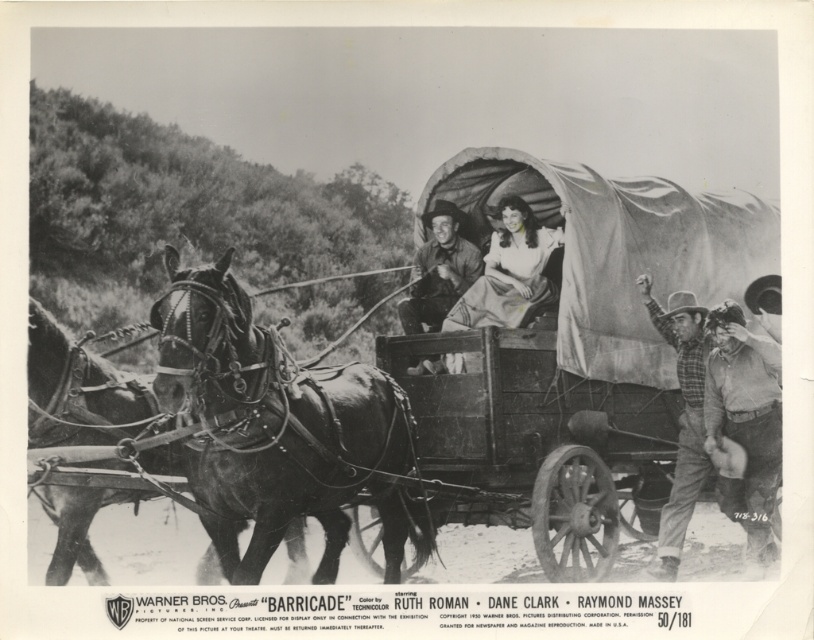
Question: Which object is the farthest from the shiny black horse at left?

Choices:
 (A) matte white dress at center
 (B) leather hat at right
 (C) leather cowboy hat at center
 (D) plaid flannel shirt at right

Answer: (B)

Question: Which point is closer to the camera taking this photo?

Choices:
 (A) (667, 522)
 (B) (47, 572)
 (C) (530, 236)

Answer: (B)

Question: Does shiny black horse at left appear under plaid flannel shirt at right?

Choices:
 (A) no
 (B) yes

Answer: (B)

Question: Is matte white dress at center positioned before leather cowboy hat at center?

Choices:
 (A) no
 (B) yes

Answer: (B)

Question: Does shiny black horse at left have a greater width compared to matte white dress at center?

Choices:
 (A) no
 (B) yes

Answer: (B)

Question: Which point is farther from the camera taking this photo?

Choices:
 (A) (405, 310)
 (B) (769, 554)

Answer: (A)